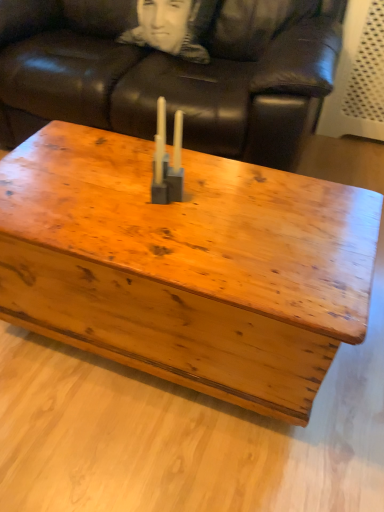
Identify the location of vacant space behind matte gray plastic candle holder at center. Image resolution: width=384 pixels, height=512 pixels. (152, 164).